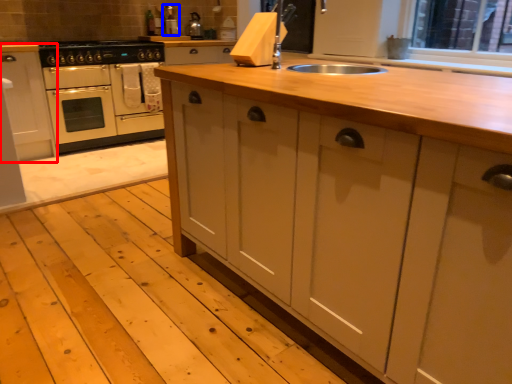
Question: Which object appears farthest to the camera in this image, cabinetry (highlighted by a red box) or appliance (highlighted by a blue box)?

Choices:
 (A) cabinetry
 (B) appliance

Answer: (B)